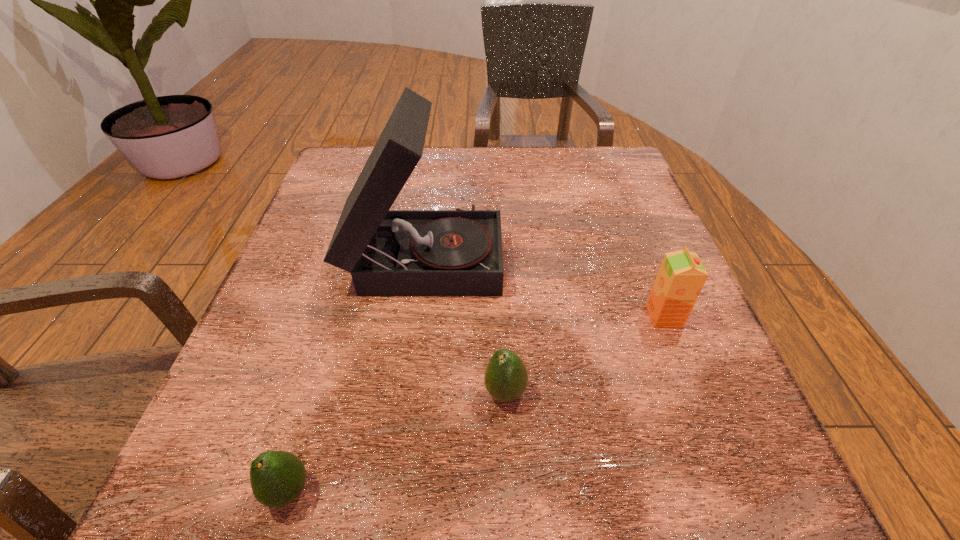
At what (x,y) coordinates should I click in order to perform the action: click on the tallest object. Please return your answer as a coordinate pair (x, y). The height and width of the screenshot is (540, 960). Looking at the image, I should click on (458, 252).

Find the location of a particular element. The width and height of the screenshot is (960, 540). phonograph_record is located at coordinates (458, 252).

Where is `the second tallest object`? the second tallest object is located at coordinates (681, 276).

Locate an element on the screen. The width and height of the screenshot is (960, 540). the rightmost object is located at coordinates (681, 276).

Identify the location of the farther avocado. (506, 378).

The height and width of the screenshot is (540, 960). I want to click on the right avocado, so click(506, 378).

At what (x,y) coordinates should I click in order to perform the action: click on the left avocado. Please return your answer as a coordinate pair (x, y). The height and width of the screenshot is (540, 960). Looking at the image, I should click on (277, 478).

You are a GUI agent. You are given a task and a screenshot of the screen. Output one action in this format:
    pyautogui.click(x=<x>, y=<y>)
    Task: Click on the nearest object
    The image size is (960, 540).
    Given the screenshot: What is the action you would take?
    pyautogui.click(x=277, y=478)

Where is `vacant space located on the front-facing side of the farthest object`? The width and height of the screenshot is (960, 540). vacant space located on the front-facing side of the farthest object is located at coordinates (669, 254).

Locate an element on the screen. The height and width of the screenshot is (540, 960). vacant region located on the left of the rightmost object is located at coordinates [x=468, y=316].